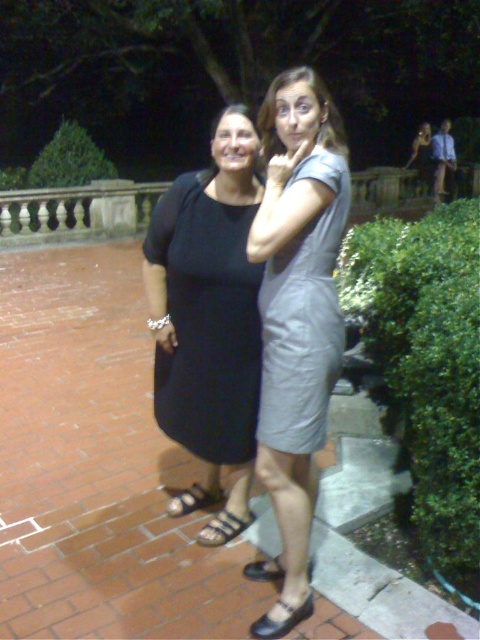
You are a photographer trying to position two subjects in a photo. The subjects are wearing the gray leather dress at center and the black leather sandal at lower center. Based on their positions, which subject is standing to the right of the other?

The gray leather dress at center is to the right of the black leather sandal at lower center.

You are a photographer trying to capture the light gray leather dress at center and the black leather sandal at lower center in a single shot. Which object should you focus on first to ensure both are in frame?

The light gray leather dress at center is above the black leather sandal at lower center, so you should focus on the light gray leather dress at center first to ensure both are in frame.

You are a photographer trying to focus on the light gray leather dress at center and the black leather sandal at lower center. Which object should you adjust your camera focus on first if you want to ensure both are in focus?

The light gray leather dress at center is closer to the viewer than the black leather sandal at lower center, so you should focus on the light gray leather dress at center first to ensure both are in focus.